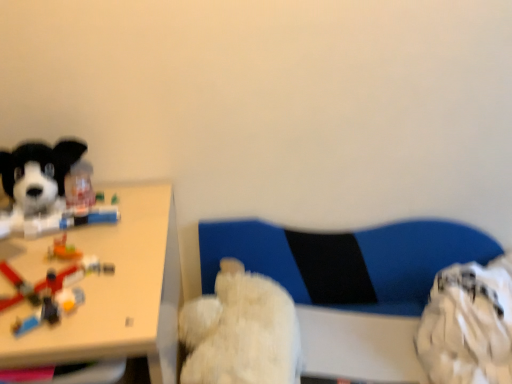
This screenshot has width=512, height=384. I want to click on free space behind translucent plastic toy at left, so click(89, 231).